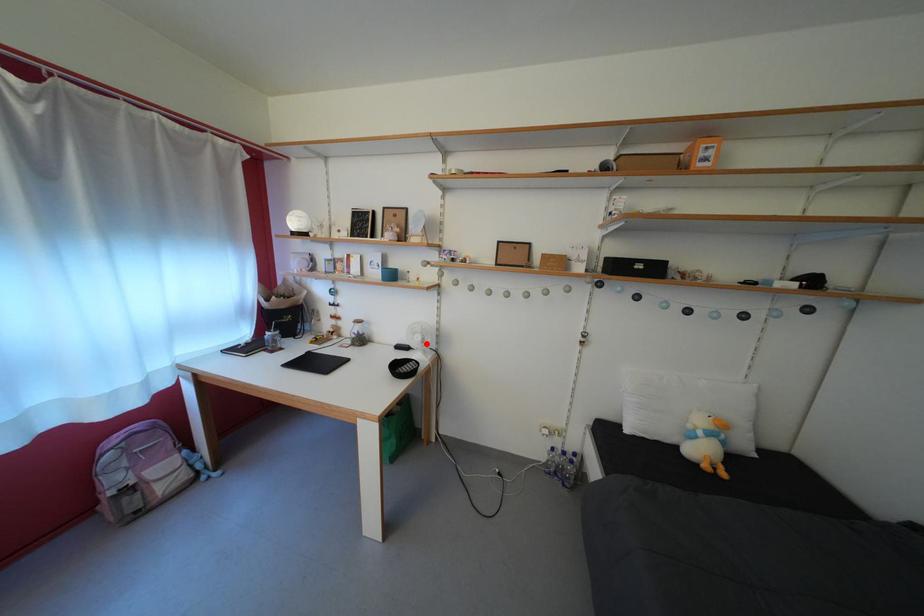
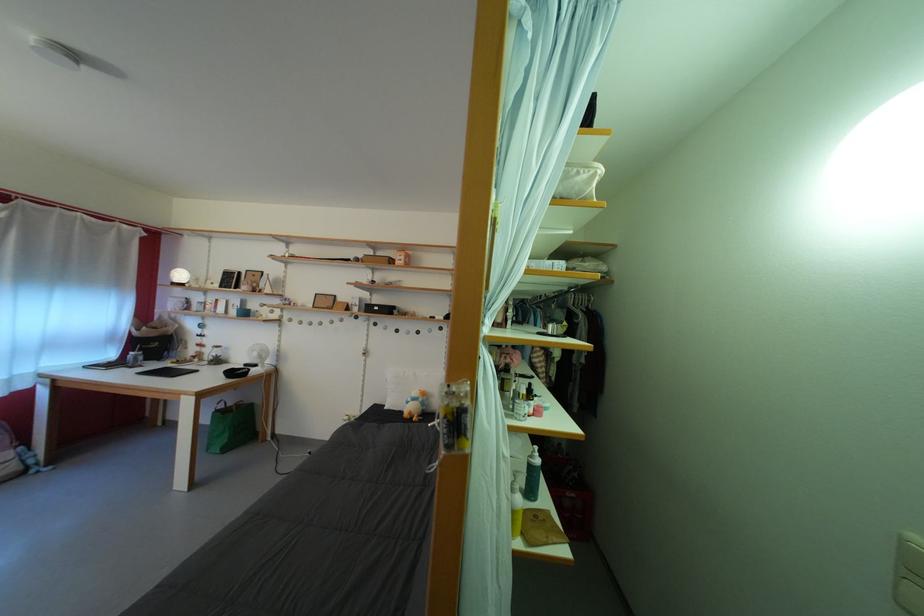
Locate, in the second image, the point that corresponds to the highlighted location in the first image.

(263, 360)